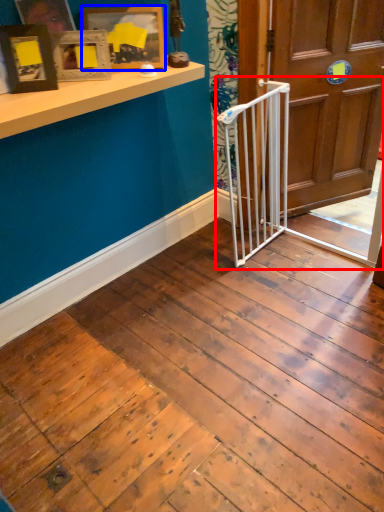
Question: Which of the following is the closest to the observer, rail (highlighted by a red box) or picture frame (highlighted by a blue box)?

Choices:
 (A) rail
 (B) picture frame

Answer: (A)